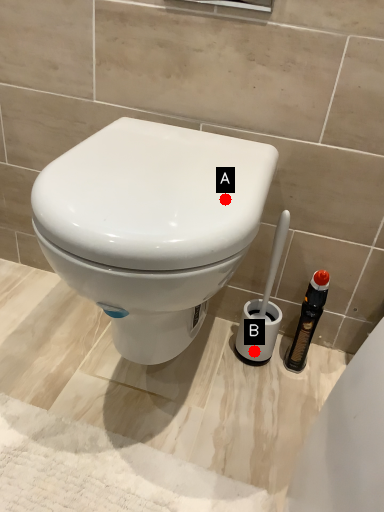
Question: Two points are circled on the image, labeled by A and B beside each circle. Which point is farther to the camera?

Choices:
 (A) A is further
 (B) B is further

Answer: (B)